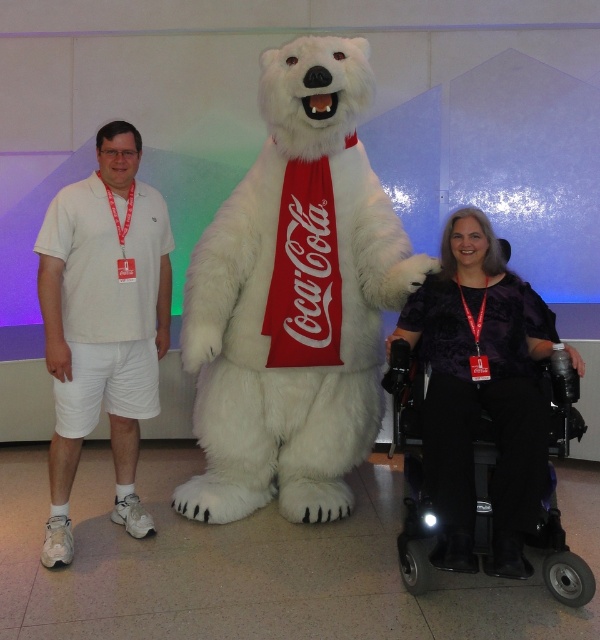
Does point (312, 84) lie in front of point (490, 381)?

No, (312, 84) is further to viewer.

Who is taller, white plush bear at center or purple satin dress at lower right?

white plush bear at center is taller.

In the scene shown: Measure the distance between point (x=261, y=100) and camera.

The distance of point (x=261, y=100) from camera is 3.19 meters.

This screenshot has width=600, height=640. Find the location of `white plush bear at center`. white plush bear at center is located at coordinates (295, 300).

Can you confirm if white plush bear at center is smaller than white cotton shorts at left?

No.

Is white plush bear at center below white cotton shorts at left?

Actually, white plush bear at center is above white cotton shorts at left.

Which is behind, point (313, 522) or point (70, 349)?

Positioned behind is point (313, 522).

What are the coordinates of `white plush bear at center` in the screenshot? It's located at (295, 300).

Which is more to the left, white cotton shorts at left or purple satin dress at lower right?

white cotton shorts at left is more to the left.

Is point (64, 365) in front of point (472, 513)?

That is False.

Which is in front, point (40, 291) or point (436, 561)?

Point (436, 561) is more forward.

Where is `white cotton shorts at left`? white cotton shorts at left is located at coordinates (103, 323).